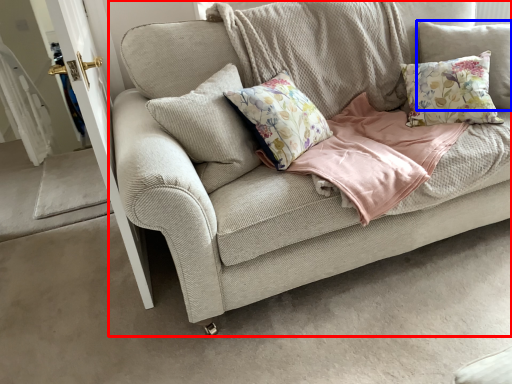
Question: Which object appears closest to the camera in this image, studio couch (highlighted by a red box) or pillow (highlighted by a blue box)?

Choices:
 (A) studio couch
 (B) pillow

Answer: (A)